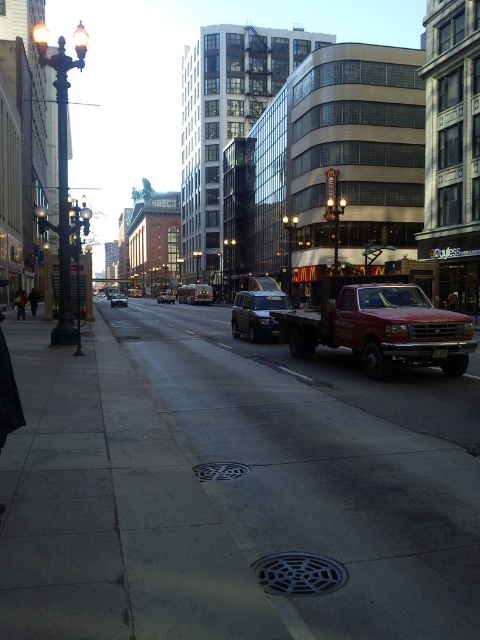
Question: Which object is the farthest from the metallic grate at center?

Choices:
 (A) matte black van at center
 (B) silver metallic sedan at center

Answer: (A)

Question: From the image, what is the correct spatial relationship of gray concrete sidewalk at center in relation to matte black van at center?

Choices:
 (A) left
 (B) right

Answer: (B)

Question: Which point appears closest to the camera in this image?

Choices:
 (A) (397, 323)
 (B) (435, 616)

Answer: (B)

Question: Does red matte truck at right have a larger size compared to black textured grate at center?

Choices:
 (A) yes
 (B) no

Answer: (A)

Question: Does gray concrete sidewalk at center have a larger size compared to black textured grate at center?

Choices:
 (A) yes
 (B) no

Answer: (A)

Question: Which of these objects is positioned closest to the gray concrete sidewalk at center?

Choices:
 (A) matte black van at center
 (B) black textured grate at center

Answer: (B)